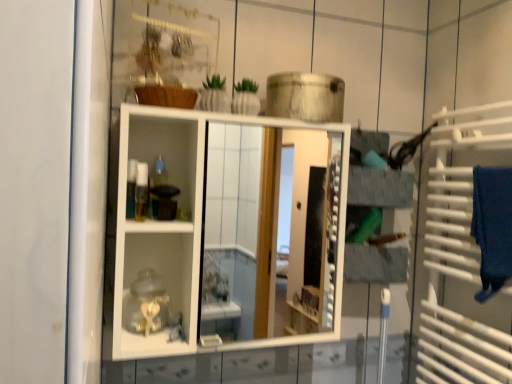
Question: From the image's perspective, is white metal towel rack at right on translucent plastic container at center?

Choices:
 (A) no
 (B) yes

Answer: (A)

Question: From a real-world perspective, is white metal towel rack at right under translucent plastic container at center?

Choices:
 (A) no
 (B) yes

Answer: (B)

Question: Is white metal towel rack at right not close to translucent plastic container at center?

Choices:
 (A) yes
 (B) no

Answer: (B)

Question: Is white metal towel rack at right at the right side of translucent plastic container at center?

Choices:
 (A) no
 (B) yes

Answer: (B)

Question: Does white metal towel rack at right have a larger size compared to translucent plastic container at center?

Choices:
 (A) yes
 (B) no

Answer: (A)

Question: Is white metal towel rack at right oriented towards translucent plastic container at center?

Choices:
 (A) no
 (B) yes

Answer: (B)

Question: Is translucent plastic container at center to the left of white glossy cabinet at center from the viewer's perspective?

Choices:
 (A) no
 (B) yes

Answer: (B)

Question: Is translucent plastic container at center oriented towards white glossy cabinet at center?

Choices:
 (A) yes
 (B) no

Answer: (A)

Question: Is the surface of translucent plastic container at center in direct contact with white glossy cabinet at center?

Choices:
 (A) yes
 (B) no

Answer: (B)

Question: Does translucent plastic container at center have a lesser height compared to white glossy cabinet at center?

Choices:
 (A) yes
 (B) no

Answer: (A)

Question: Is translucent plastic container at center taller than white glossy cabinet at center?

Choices:
 (A) yes
 (B) no

Answer: (B)

Question: Is translucent plastic container at center surrounding white glossy cabinet at center?

Choices:
 (A) no
 (B) yes

Answer: (A)

Question: Is blue fabric bath towel at right looking in the opposite direction of translucent plastic container at center?

Choices:
 (A) yes
 (B) no

Answer: (B)